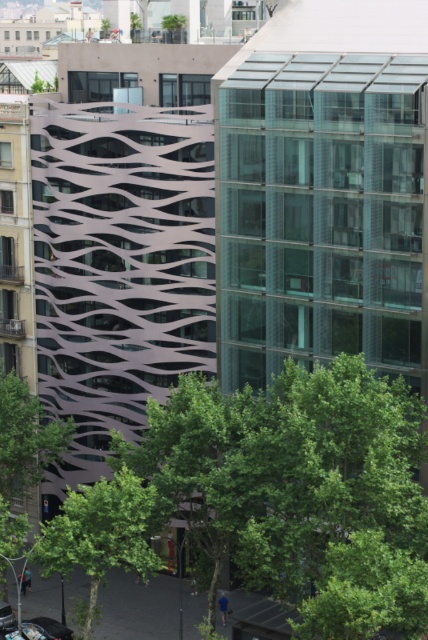
Question: Can you confirm if green leafy tree at center is smaller than green leafy tree at lower center?

Choices:
 (A) yes
 (B) no

Answer: (B)

Question: Can you confirm if green leafy tree at center is positioned above green leafy tree at lower center?

Choices:
 (A) yes
 (B) no

Answer: (A)

Question: Among these points, which one is nearest to the camera?

Choices:
 (A) (222, 419)
 (B) (85, 528)

Answer: (B)

Question: Is green leafy tree at center wider than green leafy tree at lower center?

Choices:
 (A) yes
 (B) no

Answer: (A)